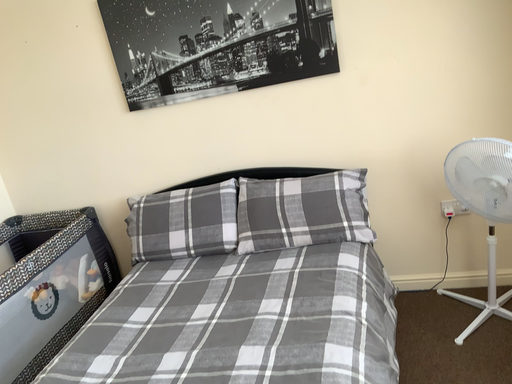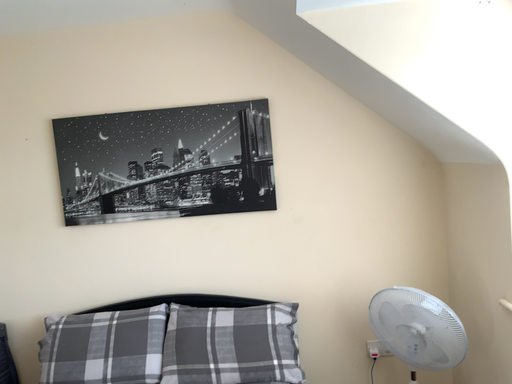
Question: Which way did the camera rotate in the video?

Choices:
 (A) rotated upward
 (B) rotated downward

Answer: (A)